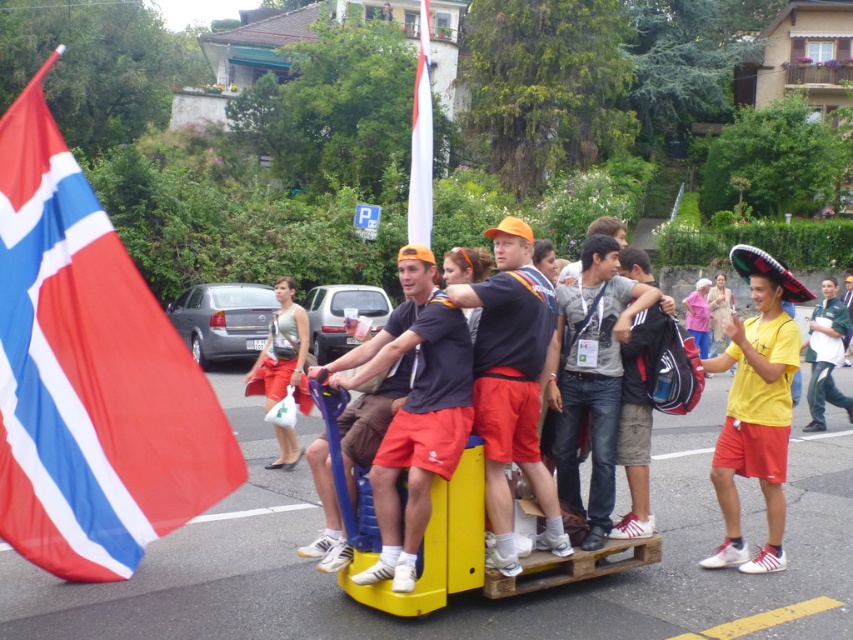
Question: Which point is closer to the camera taking this photo?

Choices:
 (A) (427, 141)
 (B) (160, 451)

Answer: (B)

Question: Can you confirm if yellow matte shirt at center is positioned below white fabric flag at center?

Choices:
 (A) no
 (B) yes

Answer: (B)

Question: Which of these objects is positioned closest to the white fabric flag at center?

Choices:
 (A) green uniform at center
 (B) black fabric backpack at center

Answer: (B)

Question: Is denim jeans at center bigger than white fabric flag at center?

Choices:
 (A) no
 (B) yes

Answer: (A)

Question: Is yellow matte shirt at center behind white fabric flag at center?

Choices:
 (A) yes
 (B) no

Answer: (B)

Question: Which point is farther from the camera taking this photo?

Choices:
 (A) (643, 401)
 (B) (3, 472)
 (C) (782, 444)
 (D) (419, 506)

Answer: (C)